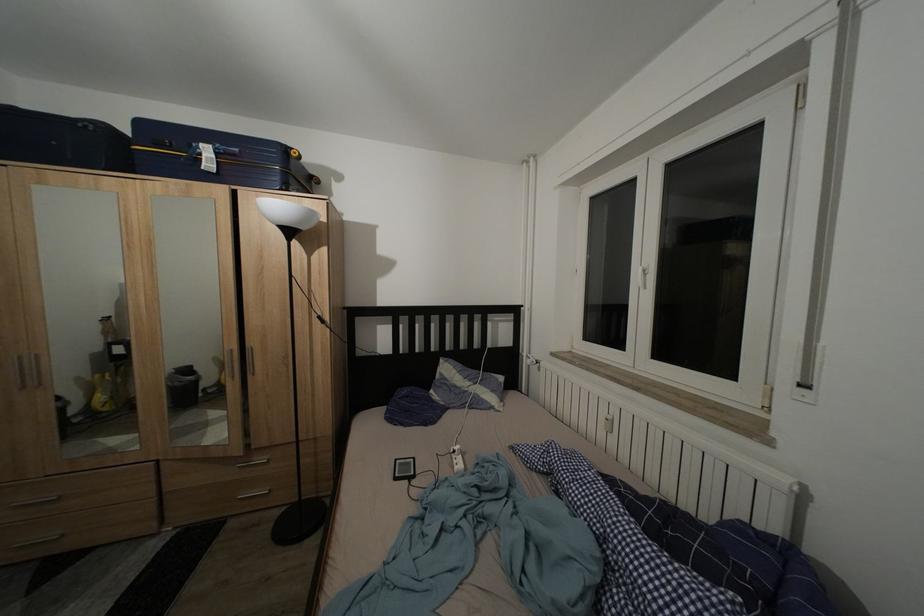
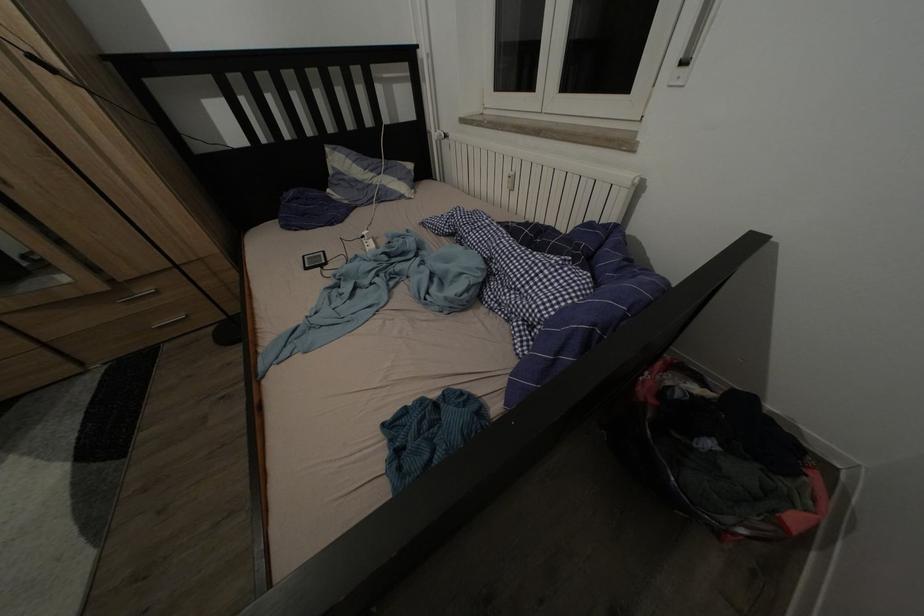
Question: I am providing you with two images of the same scene from different viewpoints. Please identify which objects are invisible in image2.

Choices:
 (A) silver drawer handle
 (B) small electronic device
 (C) white power adapter
 (D) none of these

Answer: (D)